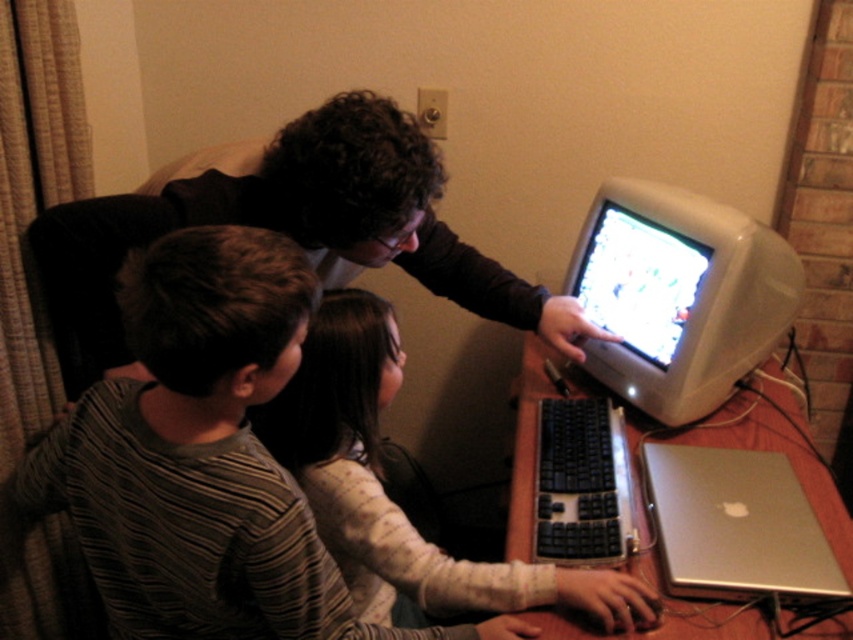
Question: Which is farther from the silver metallic laptop at lower right?

Choices:
 (A) white glossy monitor at right
 (B) matte black shirt at upper center

Answer: (B)

Question: Is white glossy monitor at right to the right of silver metallic laptop at lower right from the viewer's perspective?

Choices:
 (A) yes
 (B) no

Answer: (B)

Question: Which object is closer to the camera taking this photo?

Choices:
 (A) white glossy monitor at right
 (B) silver metallic laptop at lower right

Answer: (B)

Question: Which of the following is the farthest from the observer?

Choices:
 (A) (688, 268)
 (B) (807, 561)
 (C) (660, 301)

Answer: (C)

Question: Is striped cotton shirt at left thinner than matte plastic monitor at right?

Choices:
 (A) no
 (B) yes

Answer: (A)

Question: Is striped cotton shirt at left closer to the viewer compared to matte black shirt at upper center?

Choices:
 (A) no
 (B) yes

Answer: (B)